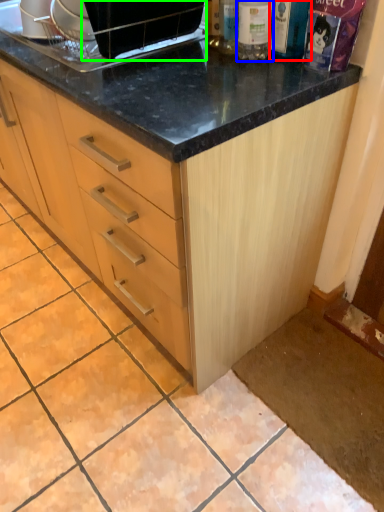
Question: Which object is positioned closest to bottle (highlighted by a red box)? Select from bottle (highlighted by a blue box) and appliance (highlighted by a green box).

Choices:
 (A) bottle
 (B) appliance

Answer: (A)